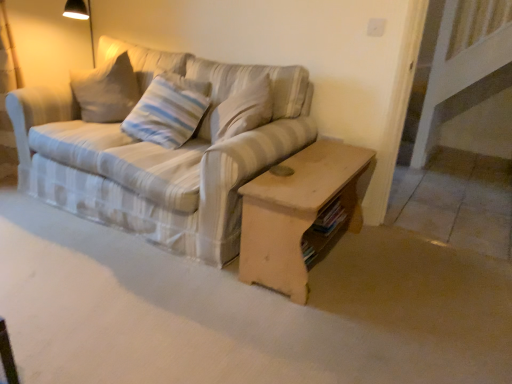
Describe the element at coordinates (158, 155) in the screenshot. Image resolution: width=512 pixels, height=384 pixels. I see `striped fabric couch at center` at that location.

Image resolution: width=512 pixels, height=384 pixels. What do you see at coordinates (295, 212) in the screenshot?
I see `wooden coffee table at center` at bounding box center [295, 212].

This screenshot has height=384, width=512. I want to click on striped fabric pillow at center, so click(168, 110).

From the image's perspective, is striped fabric couch at center under striped fabric pillow at center?

Yes, from the image's perspective, striped fabric couch at center is beneath striped fabric pillow at center.

Who is more distant, striped fabric couch at center or striped fabric pillow at center?

striped fabric pillow at center is behind.

Can you confirm if striped fabric couch at center is positioned to the left of striped fabric pillow at center?

Correct, you'll find striped fabric couch at center to the left of striped fabric pillow at center.

Is striped fabric pillow at center oriented away from wooden coffee table at center?

No.

Does striped fabric pillow at center have a greater height compared to wooden coffee table at center?

Correct, striped fabric pillow at center is much taller as wooden coffee table at center.

Do you think striped fabric pillow at center is within wooden coffee table at center, or outside of it?

striped fabric pillow at center exists outside the volume of wooden coffee table at center.

Which point is more forward, (x=175, y=127) or (x=246, y=233)?

The point (x=246, y=233) is closer.

Which of these two, wooden coffee table at center or striped fabric couch at center, stands taller?

Standing taller between the two is striped fabric couch at center.

The width and height of the screenshot is (512, 384). Find the location of `table that is under the striped fabric couch at center (from a real-world perspective)`. table that is under the striped fabric couch at center (from a real-world perspective) is located at coordinates (295, 212).

Can you tell me how much wooden coffee table at center and striped fabric couch at center differ in facing direction?

The angle between the facing direction of wooden coffee table at center and the facing direction of striped fabric couch at center is 90.3 degrees.

Does striped fabric pillow at center touch striped fabric couch at center?

No, striped fabric pillow at center is not making contact with striped fabric couch at center.

Is striped fabric pillow at center outside of striped fabric couch at center?

No, most part of striped fabric pillow at center lies within striped fabric couch at center.

From a real-world perspective, between striped fabric pillow at center and striped fabric couch at center, who is vertically higher?

striped fabric pillow at center.

Consider the image. Is wooden coffee table at center looking in the opposite direction of striped fabric pillow at center?

Yes, wooden coffee table at center's orientation is away from striped fabric pillow at center.

Between wooden coffee table at center and striped fabric pillow at center, which one has larger width?

wooden coffee table at center is wider.

From the image's perspective, is wooden coffee table at center located above striped fabric pillow at center?

Incorrect, from the image's perspective, wooden coffee table at center is lower than striped fabric pillow at center.

Is wooden coffee table at center not close to striped fabric pillow at center?

That's not correct — wooden coffee table at center is a little close to striped fabric pillow at center.

From a real-world perspective, between striped fabric couch at center and wooden coffee table at center, who is vertically lower?

In real-world perspective, wooden coffee table at center is lower.

Is striped fabric couch at center far away from wooden coffee table at center?

No, striped fabric couch at center is in close proximity to wooden coffee table at center.

Considering the sizes of objects striped fabric couch at center and wooden coffee table at center in the image provided, who is thinner, striped fabric couch at center or wooden coffee table at center?

Thinner between the two is wooden coffee table at center.

From the image's perspective, who appears lower, striped fabric couch at center or wooden coffee table at center?

From the image's view, wooden coffee table at center is below.

At what (x,y) coordinates should I click in order to perform the action: click on pillow above the striped fabric couch at center (from a real-world perspective). Please return your answer as a coordinate pair (x, y). The width and height of the screenshot is (512, 384). Looking at the image, I should click on (168, 110).

Identify the location of pillow that appears on the left of wooden coffee table at center. This screenshot has height=384, width=512. (168, 110).

Looking at the image, which one is located closer to striped fabric pillow at center, wooden coffee table at center or striped fabric couch at center?

striped fabric couch at center is positioned closer to the anchor striped fabric pillow at center.

When comparing their distances from wooden coffee table at center, does striped fabric pillow at center or striped fabric couch at center seem closer?

Among the two, striped fabric couch at center is located nearer to wooden coffee table at center.

When comparing their distances from striped fabric couch at center, does wooden coffee table at center or striped fabric pillow at center seem further?

wooden coffee table at center is further to striped fabric couch at center.

Based on the photo, estimate the real-world distances between objects in this image. Which object is closer to striped fabric couch at center, striped fabric pillow at center or wooden coffee table at center?

Among the two, striped fabric pillow at center is located nearer to striped fabric couch at center.

From the image, which object appears to be farther from wooden coffee table at center, striped fabric couch at center or striped fabric pillow at center?

The object further to wooden coffee table at center is striped fabric pillow at center.

Estimate the real-world distances between objects in this image. Which object is further from striped fabric pillow at center, striped fabric couch at center or wooden coffee table at center?

Based on the image, wooden coffee table at center appears to be further to striped fabric pillow at center.

Where is `pillow between striped fabric couch at center and wooden coffee table at center in the horizontal direction`? This screenshot has width=512, height=384. pillow between striped fabric couch at center and wooden coffee table at center in the horizontal direction is located at coordinates (168, 110).